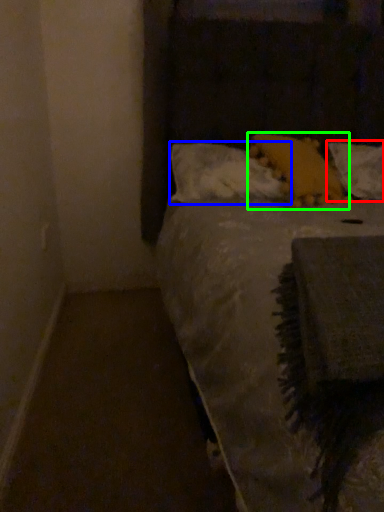
Question: Which object is positioned closest to pillow (highlighted by a red box)? Select from pillow (highlighted by a blue box) and pillow (highlighted by a green box).

Choices:
 (A) pillow
 (B) pillow

Answer: (B)